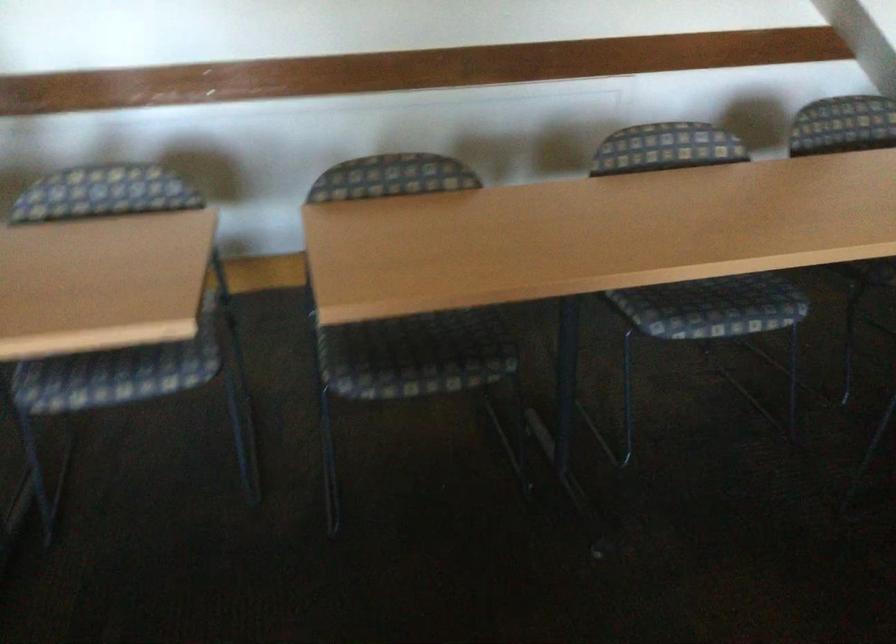
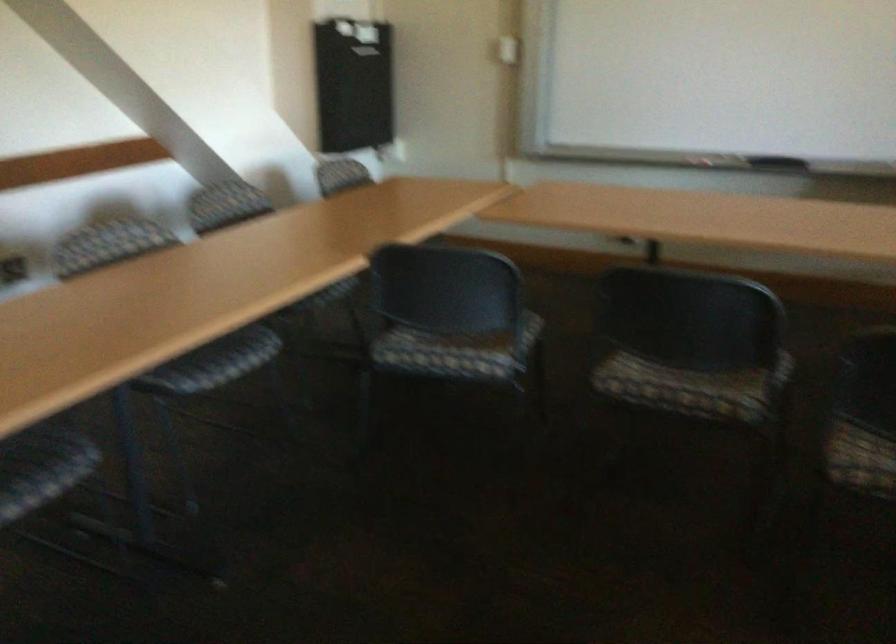
Question: Based on the continuous images, in which direction is the camera rotating? Reply with the corresponding letter.

Choices:
 (A) Left
 (B) Right
 (C) Up
 (D) Down

Answer: (B)